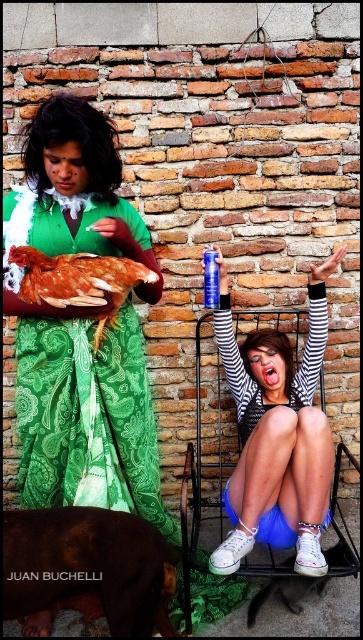
This screenshot has width=363, height=640. What do you see at coordinates (278, 433) in the screenshot? I see `striped fabric dress at center` at bounding box center [278, 433].

Does striped fabric dress at center appear on the left side of brown feathered chicken at center?

In fact, striped fabric dress at center is to the right of brown feathered chicken at center.

This screenshot has height=640, width=363. Identify the location of striped fabric dress at center. (278, 433).

Is green paisley dress at left further to the viewer compared to striped fabric dress at center?

No, green paisley dress at left is in front of striped fabric dress at center.

Between green paisley dress at left and striped fabric dress at center, which one has less height?

Standing shorter between the two is striped fabric dress at center.

You are a GUI agent. You are given a task and a screenshot of the screen. Output one action in this format:
    pyautogui.click(x=<x>, y=<y>)
    Task: Click on the green paisley dress at left
    This screenshot has height=640, width=363.
    Given the screenshot: What is the action you would take?
    pyautogui.click(x=80, y=326)

Who is positioned more to the left, green paisley dress at left or brown feathered chicken at center?

From the viewer's perspective, brown feathered chicken at center appears more on the left side.

Which is above, green paisley dress at left or brown feathered chicken at center?

brown feathered chicken at center is above.

Is point (87, 422) farther from viewer compared to point (34, 268)?

Yes.

This screenshot has height=640, width=363. I want to click on green paisley dress at left, so click(80, 326).